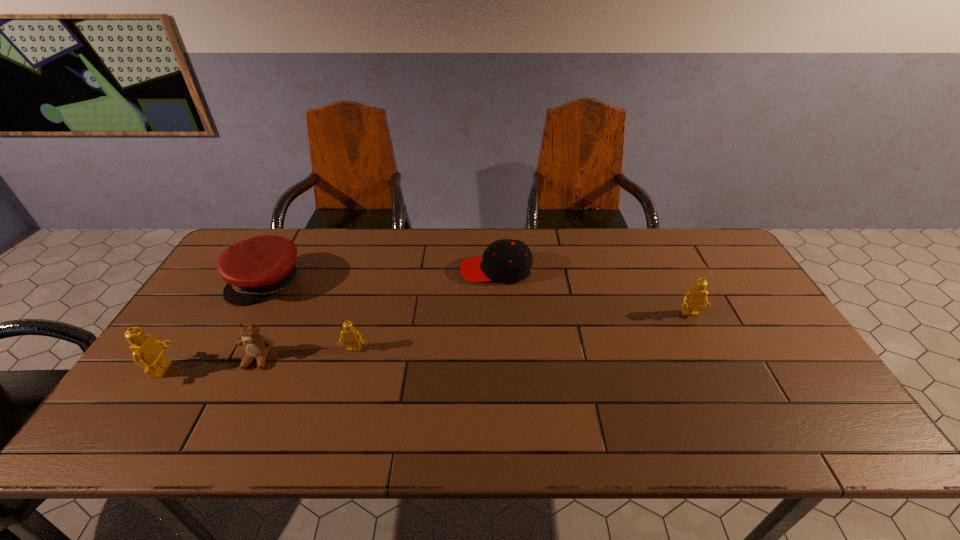
What are the coordinates of `object located in the far left corner section of the desktop` in the screenshot? It's located at (255, 268).

Where is `object that is positioned at the near left corner`? The width and height of the screenshot is (960, 540). object that is positioned at the near left corner is located at coordinates (147, 351).

I want to click on free region at the far edge, so click(x=648, y=239).

Where is `vacant space at the near edge of the desktop`? vacant space at the near edge of the desktop is located at coordinates (417, 401).

In the image, there is a desktop. What are the coordinates of `vacant space at the right edge` in the screenshot? It's located at (748, 298).

Where is `vacant area at the far left corner`? This screenshot has width=960, height=540. vacant area at the far left corner is located at coordinates (283, 229).

Locate an element on the screen. This screenshot has width=960, height=540. free spot at the far right corner of the desktop is located at coordinates (702, 243).

In the image, there is a desktop. Identify the location of free space at the near right corner. (816, 380).

Image resolution: width=960 pixels, height=540 pixels. Find the location of `blank region between the teddy bear and the rightmost Lego`. blank region between the teddy bear and the rightmost Lego is located at coordinates tap(474, 336).

At what (x,y) coordinates should I click in order to perform the action: click on vacant space in between the farthest Lego and the left cap. Please return your answer as a coordinate pair (x, y). Looking at the image, I should click on (478, 298).